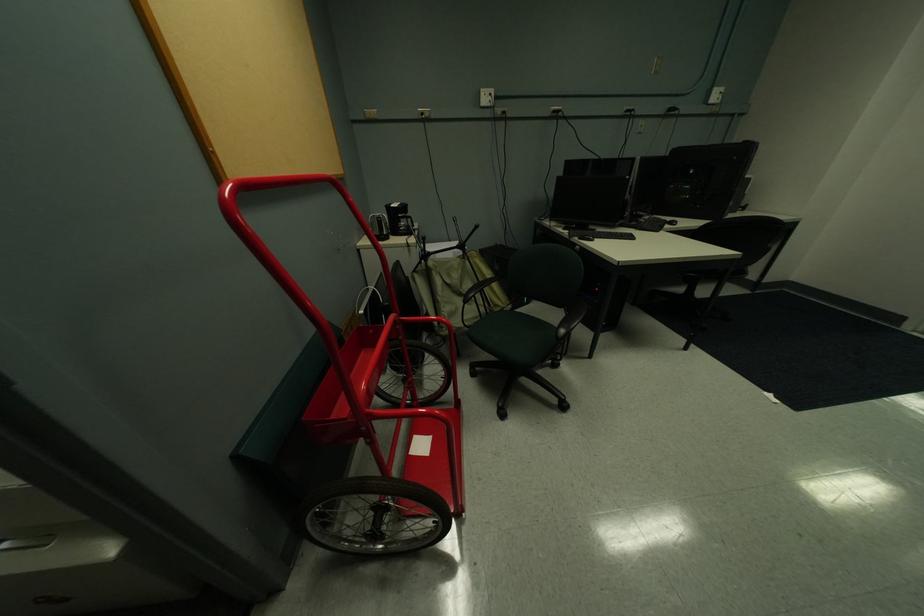
Find the location of `black chair armrest`. black chair armrest is located at coordinates (570, 318).